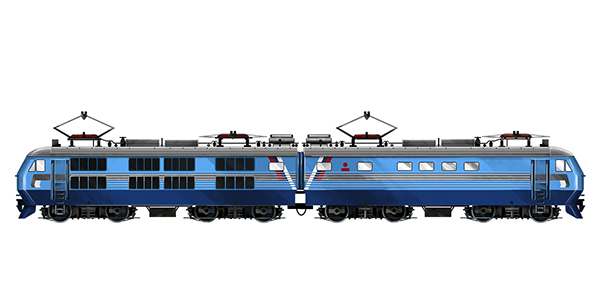
The width and height of the screenshot is (600, 300). Find the location of `door`. door is located at coordinates (543, 179).